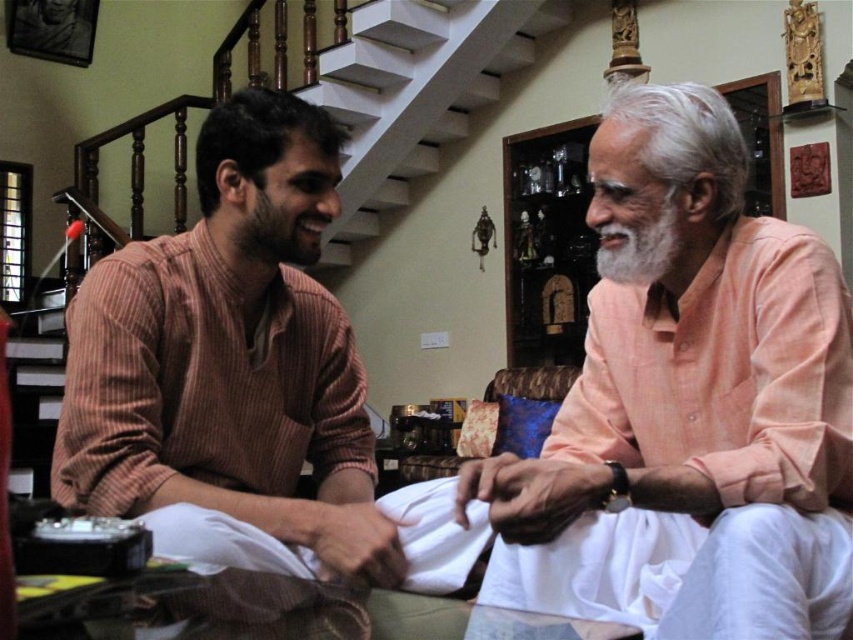
You are a tailor measuring shirts for alterations. You have two shirts in front of you, the light peach cotton shirt at center and the brown striped shirt at left. Which shirt requires a wider sleeve hem adjustment?

The brown striped shirt at left requires a wider sleeve hem adjustment since it has a greater width than the light peach cotton shirt at center.